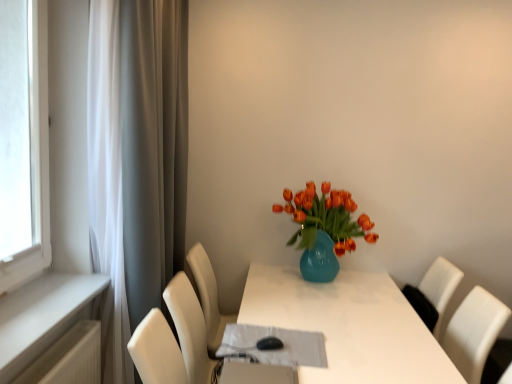
Question: From the image's perspective, is white glossy table at center positioned above or below white matte curtain at left?

Choices:
 (A) below
 (B) above

Answer: (A)

Question: Considering their positions, is white glossy table at center located in front of or behind white matte curtain at left?

Choices:
 (A) front
 (B) behind

Answer: (A)

Question: Which is farther from the matte blue vase with orange tulips at center?

Choices:
 (A) white glossy table at center
 (B) white painted wood at left
 (C) white matte curtain at left

Answer: (B)

Question: Based on their relative distances, which object is farther from the matte blue vase with orange tulips at center?

Choices:
 (A) white glossy table at center
 (B) white matte curtain at left
 (C) white painted wood at left

Answer: (C)